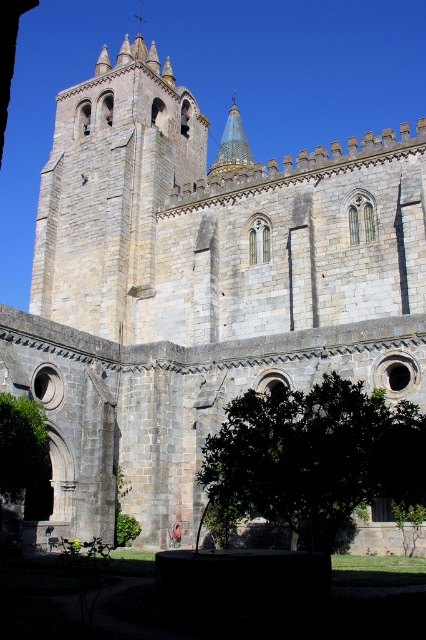
Question: Which point appears closest to the camera in this image?

Choices:
 (A) (5, 438)
 (B) (412, 451)

Answer: (B)

Question: Is green leafy tree at lower center smaller than green leafy tree at lower left?

Choices:
 (A) yes
 (B) no

Answer: (B)

Question: Is green leafy tree at lower center below green leafy tree at lower left?

Choices:
 (A) yes
 (B) no

Answer: (A)

Question: Is green leafy tree at lower center to the right of green leafy tree at lower left from the viewer's perspective?

Choices:
 (A) yes
 (B) no

Answer: (A)